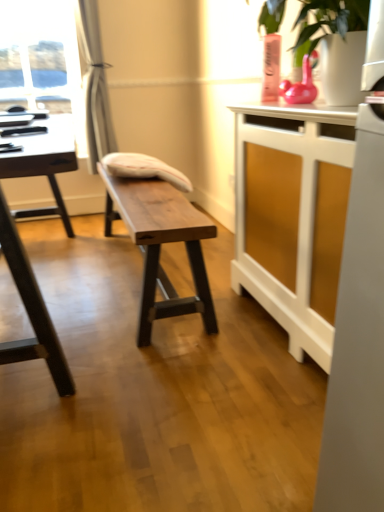
Find the location of a particular element. This screenshot has height=512, width=384. vacant area that lies between natural wood bench at center, the 2th table in the right-to-left sequence, and black glossy table at left, the 1th table from the left is located at coordinates (118, 312).